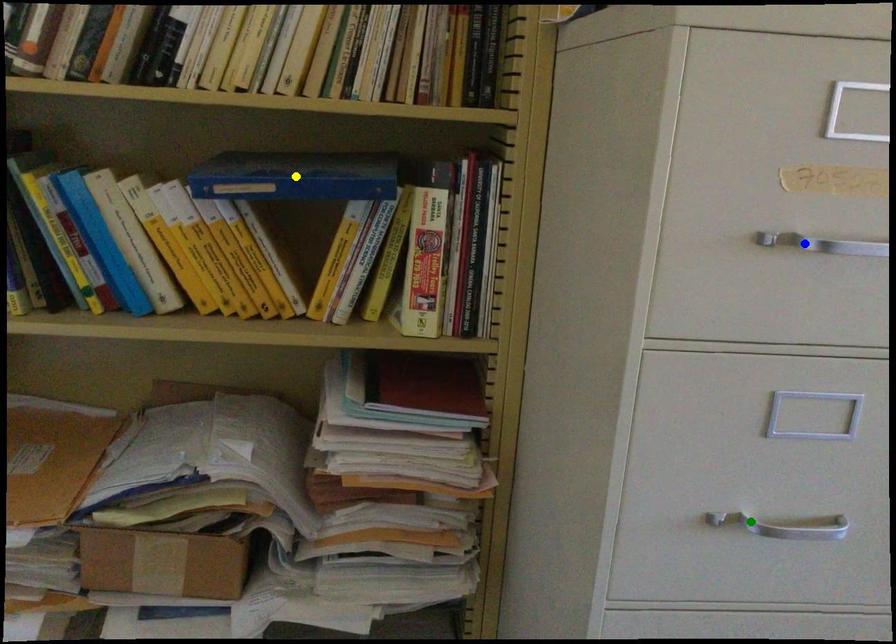
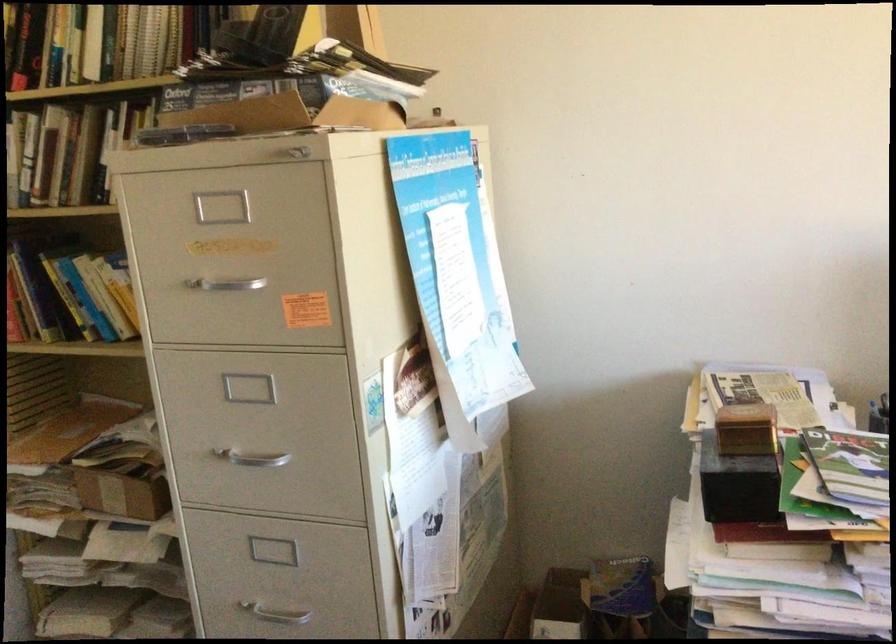
I am providing you with two images of the same scene from different viewpoints. Three points are marked in image1. Which point corresponds to a part or object that is occluded in image2?In image1, three points are marked. Which of them correspond to a part or object that is occluded in image2?Among the three points shown in image1, which one corresponds to a part or object that is no longer visible due to occlusion in image2?

yellow point cannot be seen in image2.